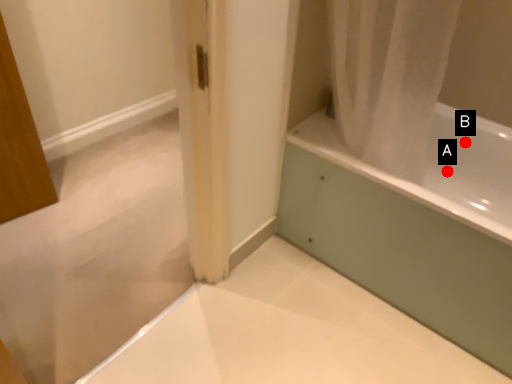
Question: Two points are circled on the image, labeled by A and B beside each circle. Which point is closer to the camera?

Choices:
 (A) A is closer
 (B) B is closer

Answer: (B)